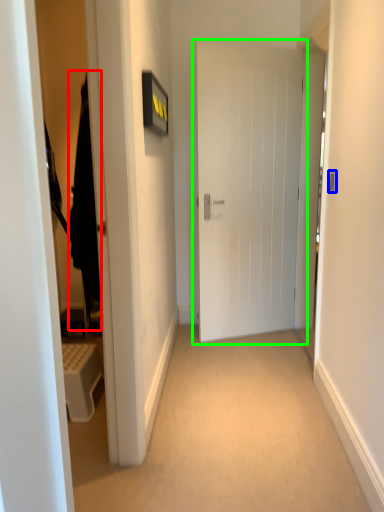
Question: Considering the real-world distances, which object is closest to robe (highlighted by a red box)? door handle (highlighted by a blue box) or door (highlighted by a green box).

Choices:
 (A) door handle
 (B) door

Answer: (A)